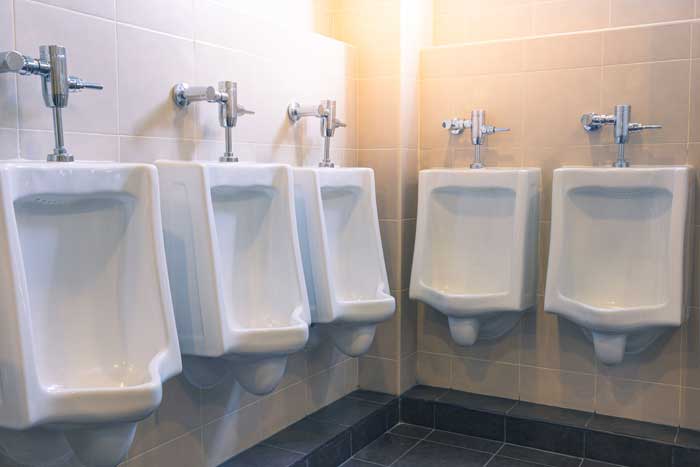
Locate an element on the screen. bathroom urinals is located at coordinates (70, 286), (228, 244), (346, 230), (448, 233), (617, 256).